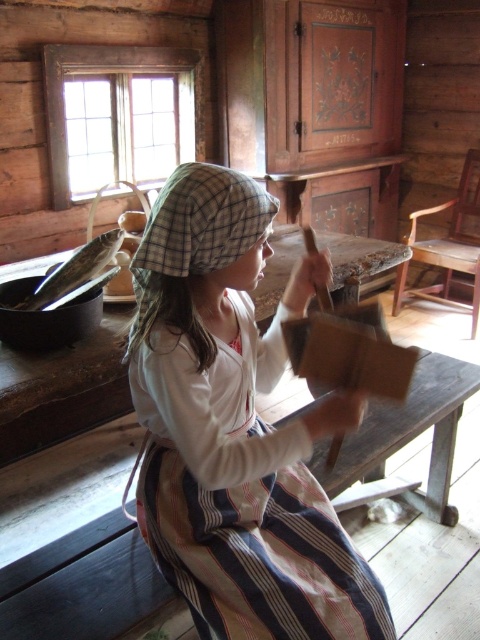
This screenshot has width=480, height=640. Describe the element at coordinates (236, 428) in the screenshot. I see `striped cotton apron at center` at that location.

Who is shorter, striped cotton apron at center or plaid fabric hat at center?

Standing shorter between the two is plaid fabric hat at center.

You are a GUI agent. You are given a task and a screenshot of the screen. Output one action in this format:
    pyautogui.click(x=<x>, y=<y>)
    Task: Click on the striped cotton apron at center
    The height and width of the screenshot is (640, 480).
    Given the screenshot: What is the action you would take?
    pyautogui.click(x=236, y=428)